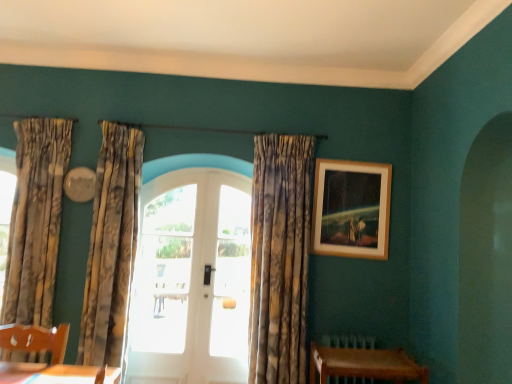
Find the location of a particular element. Image resolution: width=512 pixels, height=384 pixels. white glass door at center, which is counted as the 2th window, starting from the right is located at coordinates (163, 273).

Where is `textured beige curtains at left, the 2th curtain from the right`? The image size is (512, 384). textured beige curtains at left, the 2th curtain from the right is located at coordinates (111, 246).

What is the approximate height of textured gold curtain at center, the third curtain from the left?

textured gold curtain at center, the third curtain from the left, is 5.96 feet in height.

What do you see at coordinates (351, 209) in the screenshot? I see `wooden frame at upper right` at bounding box center [351, 209].

Locate an element on the screen. white glossy door at center is located at coordinates (191, 279).

Where is `wooden table at lower right`? This screenshot has width=512, height=384. wooden table at lower right is located at coordinates (x=365, y=364).

What are the coordinates of `brown wooden radiator at lower right` in the screenshot? It's located at (349, 341).

The width and height of the screenshot is (512, 384). Find the location of `patterned fabric curtain at left, the third curtain in the right-to-left sequence`. patterned fabric curtain at left, the third curtain in the right-to-left sequence is located at coordinates (35, 220).

Does point (133, 224) lie in front of point (178, 334)?

Yes, it is in front of point (178, 334).

Choose the correct answer: Is textured beige curtains at left, the 2th curtain from the right, inside white glass door at center, which is counted as the 2th window, starting from the right, or outside it?

textured beige curtains at left, the 2th curtain from the right, is outside white glass door at center, which is counted as the 2th window, starting from the right.

Which object is positioned more to the left, textured beige curtains at left, which ranks as the second curtain in left-to-right order, or white glass door at center, the 1th window when ordered from left to right?

From the viewer's perspective, textured beige curtains at left, which ranks as the second curtain in left-to-right order, appears more on the left side.

Between textured beige curtains at left, which ranks as the second curtain in left-to-right order, and white glass door at center, the 1th window when ordered from left to right, which one has larger width?

With larger width is textured beige curtains at left, which ranks as the second curtain in left-to-right order.

Is wooden table at lower right shorter than brown wooden radiator at lower right?

Correct, wooden table at lower right is not as tall as brown wooden radiator at lower right.

Would you say wooden table at lower right is to the left or to the right of brown wooden radiator at lower right in the picture?

Based on their positions, wooden table at lower right is located to the right of brown wooden radiator at lower right.

From the image's perspective, which is below, wooden table at lower right or brown wooden radiator at lower right?

From the image's view, brown wooden radiator at lower right is below.

What's the angular difference between wooden table at lower right and brown wooden radiator at lower right's facing directions?

0.00313 degrees.

From the image's perspective, relative to wooden frame at upper right, is brown wooden radiator at lower right above or below?

Clearly, from the image's perspective, brown wooden radiator at lower right is below wooden frame at upper right.

In terms of height, does brown wooden radiator at lower right look taller or shorter compared to wooden frame at upper right?

Clearly, brown wooden radiator at lower right is shorter compared to wooden frame at upper right.

Which of these two, brown wooden radiator at lower right or wooden frame at upper right, is smaller?

brown wooden radiator at lower right is smaller.

Is patterned fabric curtain at left, which ranks as the first curtain in left-to-right order, at the right side of wooden frame at upper right?

No, patterned fabric curtain at left, which ranks as the first curtain in left-to-right order, is not to the right of wooden frame at upper right.

Does patterned fabric curtain at left, which ranks as the first curtain in left-to-right order, lie behind wooden frame at upper right?

No, the depth of patterned fabric curtain at left, which ranks as the first curtain in left-to-right order, is less than that of wooden frame at upper right.

Who is bigger, patterned fabric curtain at left, the third curtain in the right-to-left sequence, or wooden frame at upper right?

patterned fabric curtain at left, the third curtain in the right-to-left sequence.

Considering the sizes of objects textured gold curtain at center, which is counted as the 1th curtain, starting from the right, and white glossy door at center in the image provided, who is shorter, textured gold curtain at center, which is counted as the 1th curtain, starting from the right, or white glossy door at center?

With less height is white glossy door at center.

Locate an element on the screen. Image resolution: width=512 pixels, height=384 pixels. door below the textured gold curtain at center, the third curtain from the left (from the image's perspective) is located at coordinates (191, 279).

What's the angular difference between textured gold curtain at center, the third curtain from the left, and white glossy door at center's facing directions?

0.115 degrees.

Is textured gold curtain at center, which is counted as the 1th curtain, starting from the right, to the right of white glossy door at center from the viewer's perspective?

Yes, textured gold curtain at center, which is counted as the 1th curtain, starting from the right, is to the right of white glossy door at center.

Is wooden frame at upper right positioned far away from wooden table at lower right?

No.

From the image's perspective, is wooden frame at upper right positioned above or below wooden table at lower right?

From the image's perspective, wooden frame at upper right appears above wooden table at lower right.

How many degrees apart are the facing directions of wooden frame at upper right and wooden table at lower right?

The angle between the facing direction of wooden frame at upper right and the facing direction of wooden table at lower right is 0.0288 degrees.

In the scene shown: Is wooden frame at upper right looking in the opposite direction of wooden table at lower right?

wooden frame at upper right does not have its back to wooden table at lower right.

There is a wooden table at lower right. Where is `the 3rd curtain above it (from the image's perspective)`? the 3rd curtain above it (from the image's perspective) is located at coordinates (35, 220).

Considering the relative sizes of patterned fabric curtain at left, the third curtain in the right-to-left sequence, and wooden table at lower right in the image provided, is patterned fabric curtain at left, the third curtain in the right-to-left sequence, smaller than wooden table at lower right?

Actually, patterned fabric curtain at left, the third curtain in the right-to-left sequence, might be larger than wooden table at lower right.

From the image's perspective, is patterned fabric curtain at left, which ranks as the first curtain in left-to-right order, below wooden table at lower right?

No, from the image's perspective, patterned fabric curtain at left, which ranks as the first curtain in left-to-right order, is not beneath wooden table at lower right.

Identify the location of the 2nd window behind the textured beige curtains at left, which ranks as the second curtain in left-to-right order, counting from the anchor's position. (163, 273).

Where is `table that appears above the brown wooden radiator at lower right (from a real-world perspective)`? This screenshot has height=384, width=512. table that appears above the brown wooden radiator at lower right (from a real-world perspective) is located at coordinates (365, 364).

Looking at the image, which one is located closer to white glossy door at center, white glass door at center, the second window viewed from the left, or brown wooden radiator at lower right?

white glass door at center, the second window viewed from the left, is positioned closer to the anchor white glossy door at center.

Based on their spatial positions, is textured beige curtains at left, which ranks as the second curtain in left-to-right order, or wooden table at lower right closer to textured gold curtain at center, which is counted as the 1th curtain, starting from the right?

Based on the image, wooden table at lower right appears to be nearer to textured gold curtain at center, which is counted as the 1th curtain, starting from the right.

Considering their positions, is patterned fabric curtain at left, the third curtain in the right-to-left sequence, positioned further to brown wooden radiator at lower right than wooden table at lower right?

patterned fabric curtain at left, the third curtain in the right-to-left sequence, is positioned further to the anchor brown wooden radiator at lower right.

Considering their positions, is white glass door at center, the 1th window when ordered from left to right, positioned further to textured gold curtain at center, the third curtain from the left, than white glass door at center, the second window viewed from the left?

white glass door at center, the 1th window when ordered from left to right, is further to textured gold curtain at center, the third curtain from the left.

In the scene shown: Estimate the real-world distances between objects in this image. Which object is further from textured beige curtains at left, the 2th curtain from the right, wooden frame at upper right or patterned fabric curtain at left, which ranks as the first curtain in left-to-right order?

The object further to textured beige curtains at left, the 2th curtain from the right, is wooden frame at upper right.

When comparing their distances from brown wooden radiator at lower right, does textured beige curtains at left, the 2th curtain from the right, or white glass door at center, which is counted as the 2th window, starting from the right, seem closer?

Among the two, white glass door at center, which is counted as the 2th window, starting from the right, is located nearer to brown wooden radiator at lower right.

When comparing their distances from wooden frame at upper right, does white glass door at center, which is the first window from right to left, or patterned fabric curtain at left, the third curtain in the right-to-left sequence, seem further?

patterned fabric curtain at left, the third curtain in the right-to-left sequence, lies further to wooden frame at upper right than the other object.

From the image, which object appears to be nearer to white glass door at center, which is the first window from right to left, patterned fabric curtain at left, the third curtain in the right-to-left sequence, or textured beige curtains at left, which ranks as the second curtain in left-to-right order?

Among the two, textured beige curtains at left, which ranks as the second curtain in left-to-right order, is located nearer to white glass door at center, which is the first window from right to left.

I want to click on door located between patterned fabric curtain at left, which ranks as the first curtain in left-to-right order, and wooden frame at upper right in the left-right direction, so click(x=191, y=279).

Where is `curtain situated between patterned fabric curtain at left, the third curtain in the right-to-left sequence, and white glass door at center, which is counted as the 2th window, starting from the right, from left to right`? The image size is (512, 384). curtain situated between patterned fabric curtain at left, the third curtain in the right-to-left sequence, and white glass door at center, which is counted as the 2th window, starting from the right, from left to right is located at coordinates (111, 246).

Where is `door situated between patterned fabric curtain at left, which ranks as the first curtain in left-to-right order, and wooden table at lower right from left to right`? The image size is (512, 384). door situated between patterned fabric curtain at left, which ranks as the first curtain in left-to-right order, and wooden table at lower right from left to right is located at coordinates (191, 279).

At what (x,y) coordinates should I click in order to perform the action: click on curtain between textured beige curtains at left, which ranks as the second curtain in left-to-right order, and wooden frame at upper right, in the horizontal direction. Please return your answer as a coordinate pair (x, y). The image size is (512, 384). Looking at the image, I should click on (279, 257).